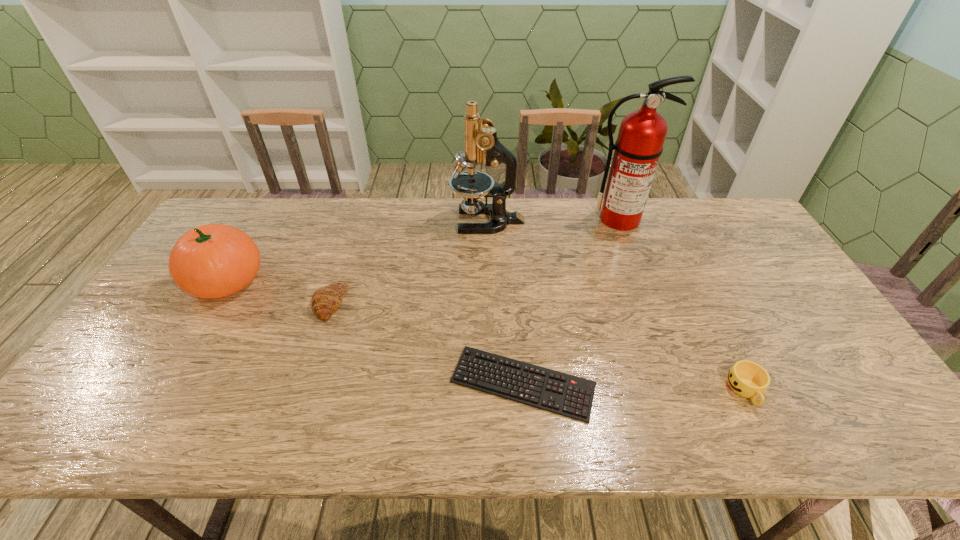
Identify the location of free area in between the fire extinguisher and the cup. The height and width of the screenshot is (540, 960). 683,305.

Find the location of `empty space between the fifth shortest object and the leftmost object`. empty space between the fifth shortest object and the leftmost object is located at coordinates (357, 251).

Locate an element on the screen. vacant area that lies between the leftmost object and the fifth object from right to left is located at coordinates (278, 292).

What are the coordinates of `unoccupied position between the cup and the fire extinguisher` in the screenshot? It's located at (683, 305).

Find the location of `vacant space that is in between the fifth object from right to left and the fire extinguisher`. vacant space that is in between the fifth object from right to left and the fire extinguisher is located at coordinates (474, 261).

Where is `object that is the closest to the fire extinguisher`? object that is the closest to the fire extinguisher is located at coordinates (481, 143).

Locate an element on the screen. The width and height of the screenshot is (960, 540). object that is the fourth nearest to the second object from left to right is located at coordinates (642, 133).

Where is `vacant area in the image that satisfies the following two spatial constraints: 1. on the front side of the crescent roll; 2. on the left side of the fourth shortest object`? Image resolution: width=960 pixels, height=540 pixels. vacant area in the image that satisfies the following two spatial constraints: 1. on the front side of the crescent roll; 2. on the left side of the fourth shortest object is located at coordinates (212, 304).

This screenshot has width=960, height=540. I want to click on free spot that satisfies the following two spatial constraints: 1. at the eyepiece of the second tallest object; 2. on the front side of the crescent roll, so click(x=489, y=304).

The height and width of the screenshot is (540, 960). Find the location of `vacant position in the image that satisfies the following two spatial constraints: 1. at the nozzle of the cup; 2. on the left side of the fire extinguisher`. vacant position in the image that satisfies the following two spatial constraints: 1. at the nozzle of the cup; 2. on the left side of the fire extinguisher is located at coordinates (684, 390).